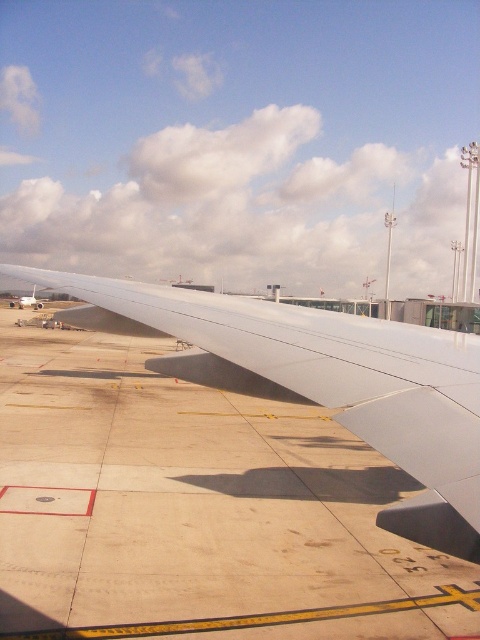
You are a pilot preparing to taxi the aircraft. You need to locate the white matte wing at center to ensure proper alignment with the runway. Based on its coordinates, is the wing positioned closer to the left or right side of the aircraft?

The white matte wing at center is positioned at point 0.597 on the x and 0.675 on the y, which places it closer to the right side of the aircraft.

You are inside an aircraft looking out the window. There are two points marked on the wing and tarmac. The first point is at coordinates point [339,314] and the second is at point [39,307]. Which point is closer to you?

Point [339,314] is closer to the viewer than point [39,307].